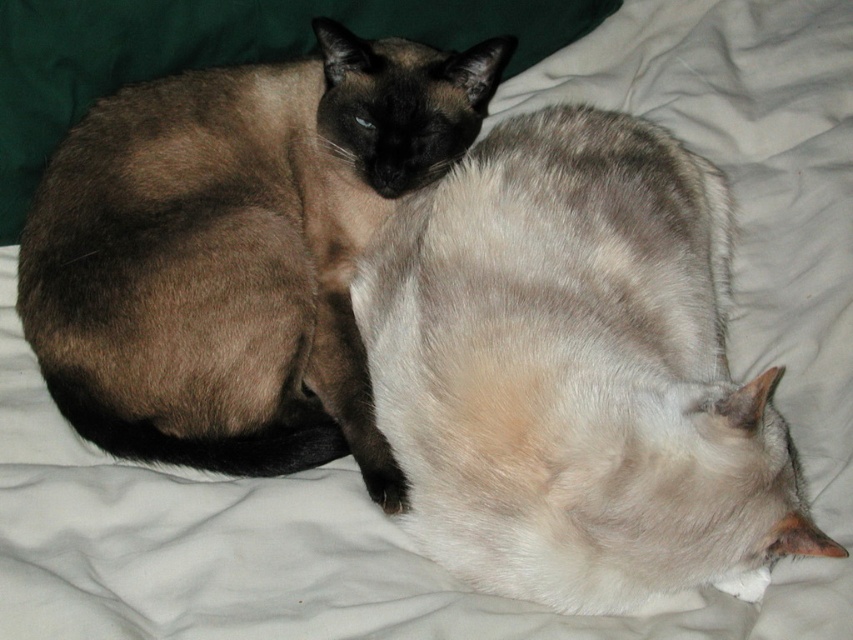
Question: Which point is farther to the camera?

Choices:
 (A) (537, 518)
 (B) (189, 205)

Answer: (B)

Question: Can you confirm if silky white cat at center is positioned below brown fur cat at upper left?

Choices:
 (A) yes
 (B) no

Answer: (A)

Question: Is the position of silky white cat at center more distant than that of brown fur cat at upper left?

Choices:
 (A) yes
 (B) no

Answer: (B)

Question: Can you confirm if silky white cat at center is thinner than brown fur cat at upper left?

Choices:
 (A) yes
 (B) no

Answer: (A)